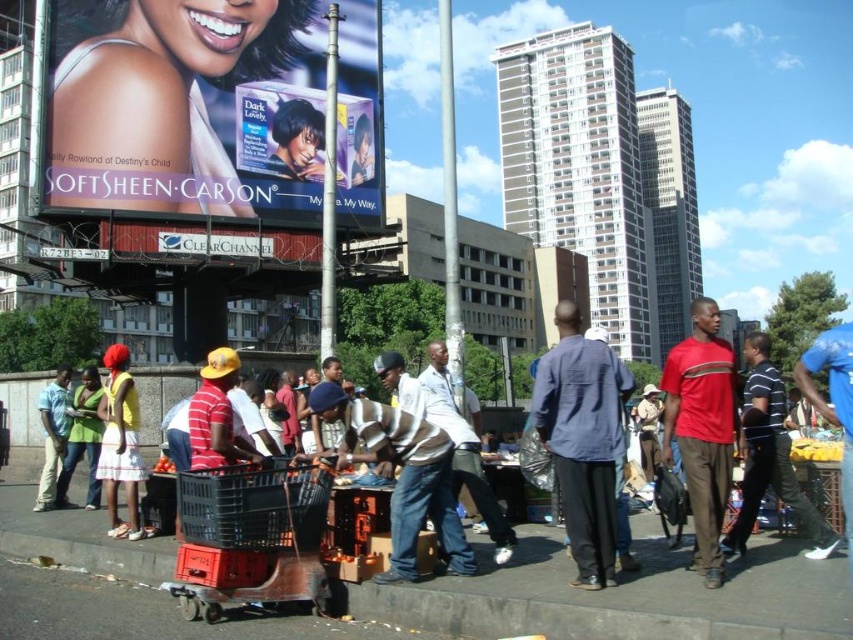
Does striped cotton shirt at center have a smaller size compared to blue cotton shirt at center?

No.

What do you see at coordinates (579, 435) in the screenshot?
I see `striped cotton shirt at center` at bounding box center [579, 435].

What are the coordinates of `striped cotton shirt at center` in the screenshot? It's located at (579, 435).

This screenshot has height=640, width=853. Find the location of `striped cotton shirt at center`. striped cotton shirt at center is located at coordinates (579, 435).

Is matte plastic billboard at upper left smaller than blue cotton shirt at center?

Yes.

Is point (262, 144) closer to viewer compared to point (599, 484)?

No, (262, 144) is further to viewer.

In the scene shown: Measure the distance between point (231, 102) and camera.

The distance of point (231, 102) from camera is 39.44 meters.

What are the coordinates of `matte plastic billboard at upper left` in the screenshot? It's located at (187, 106).

Is blue cotton shirt at center positioned at the back of striped jersey at center?

No, it is not.

Which is in front, point (611, 420) or point (445, 522)?

Point (445, 522)

Which is in front, point (567, 509) or point (378, 403)?

Point (567, 509)

Locate an element on the screen. blue cotton shirt at center is located at coordinates (583, 440).